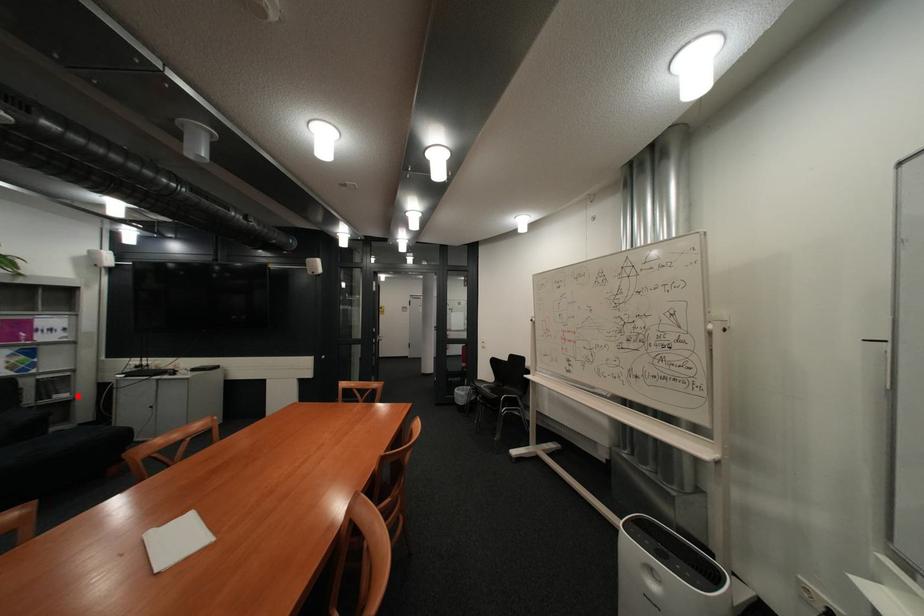
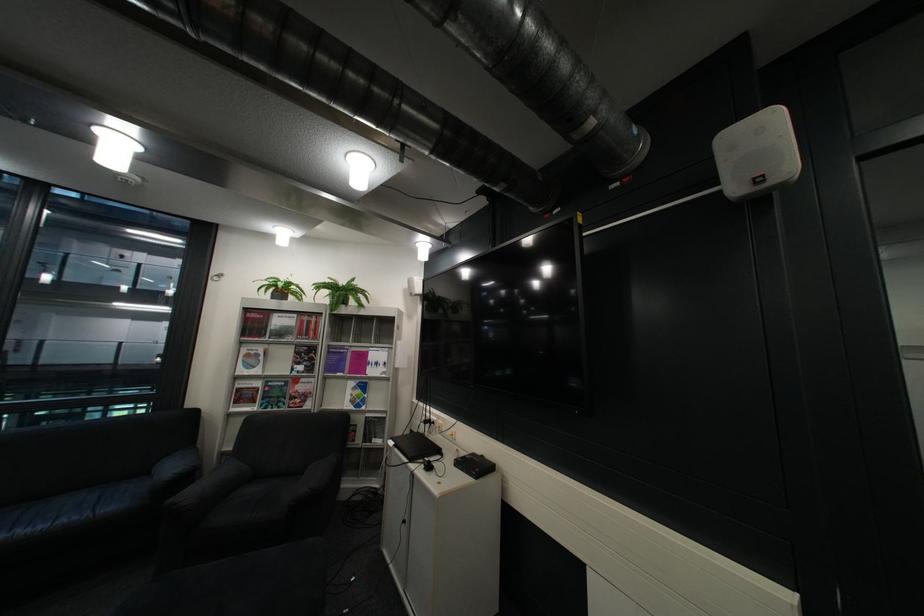
Question: I am providing you with two images of the same scene from different viewpoints. In image1, a red point is highlighted. Considering the same 3D point in image2, which of the following is correct?

Choices:
 (A) It is closer
 (B) It is farther

Answer: (B)